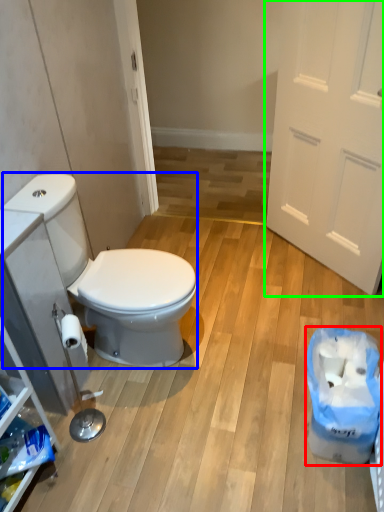
Question: Which is farther away from recycling bin (highlighted by a red box)? sit (highlighted by a blue box) or door (highlighted by a green box)?

Choices:
 (A) sit
 (B) door

Answer: (B)